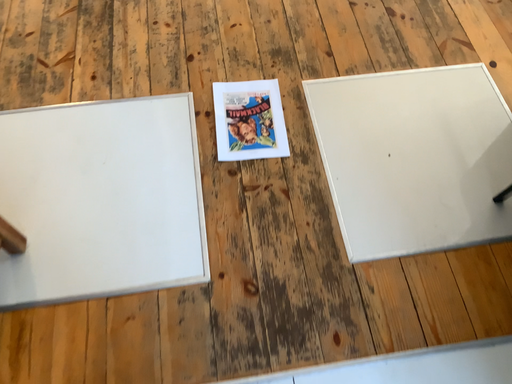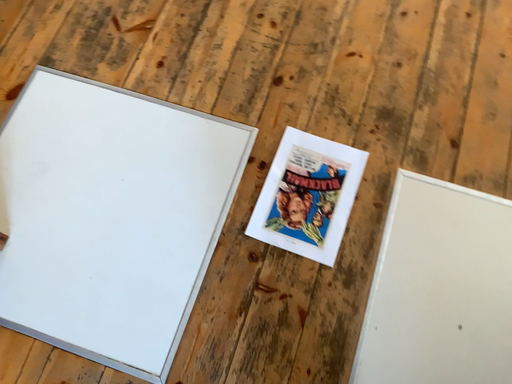
Question: How did the camera likely rotate when shooting the video?

Choices:
 (A) rotated downward
 (B) rotated upward

Answer: (A)